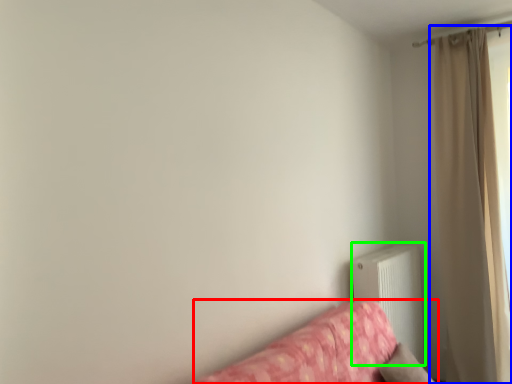
Question: Which object is positioned closest to studio couch (highlighted by a red box)? Select from curtain (highlighted by a blue box) and radiator (highlighted by a green box).

Choices:
 (A) curtain
 (B) radiator

Answer: (B)